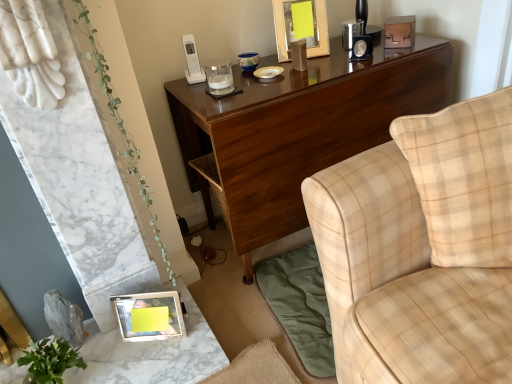
Question: Is glossy wood desk at upper center wider or thinner than yellow paper at upper center, arranged as the second picture frame when viewed from the front?

Choices:
 (A) thin
 (B) wide

Answer: (B)

Question: From the image's perspective, relative to yellow paper at upper center, the first picture frame from the back, is glossy wood desk at upper center above or below?

Choices:
 (A) above
 (B) below

Answer: (B)

Question: Estimate the real-world distances between objects in this image. Which object is closer to the metallic silver frame at lower left?

Choices:
 (A) green leafy plant at lower left
 (B) beige plaid pillow at right
 (C) glossy wood desk at upper center
 (D) yellow paper at upper center, which is the first picture frame in top-to-bottom order
 (E) beige plaid fabric couch at upper right

Answer: (A)

Question: Which of these objects is positioned closest to the metallic silver photo frame at lower left, positioned as the second picture frame in top-to-bottom order?

Choices:
 (A) metallic silver frame at lower left
 (B) green leafy plant at lower left
 (C) beige plaid pillow at right
 (D) beige plaid fabric couch at upper right
 (E) glossy wood desk at upper center

Answer: (A)